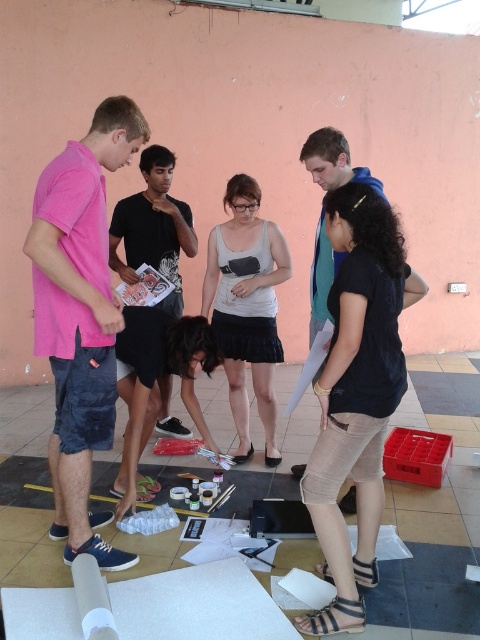
Question: Does black linen skirt at lower center appear on the left side of black matte shorts at center?

Choices:
 (A) yes
 (B) no

Answer: (B)

Question: Does matte gray tank top at center lie behind blue cotton shirt at center?

Choices:
 (A) yes
 (B) no

Answer: (A)

Question: Is black cotton shirt at center closer to the viewer compared to blue cotton shirt at center?

Choices:
 (A) no
 (B) yes

Answer: (A)

Question: Estimate the real-world distances between objects in this image. Which object is closer to the pink cotton shirt at left?

Choices:
 (A) black linen skirt at lower center
 (B) blue cotton shirt at center
 (C) black matte shorts at center

Answer: (C)

Question: Among these objects, which one is nearest to the camera?

Choices:
 (A) blue cotton shirt at center
 (B) black cotton shirt at center

Answer: (A)

Question: Which object appears farthest from the camera in this image?

Choices:
 (A) black matte shorts at center
 (B) matte gray tank top at center
 (C) blue cotton shirt at center

Answer: (B)